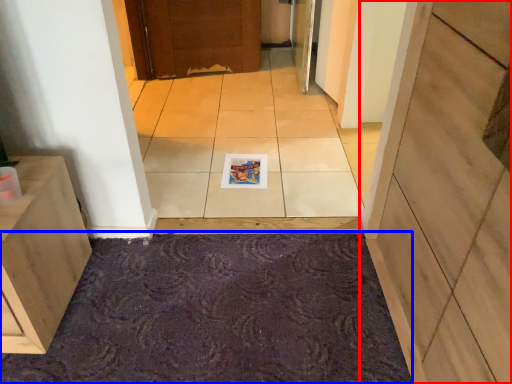
Question: Among these objects, which one is farthest to the camera, door (highlighted by a red box) or bath mat (highlighted by a blue box)?

Choices:
 (A) door
 (B) bath mat

Answer: (B)